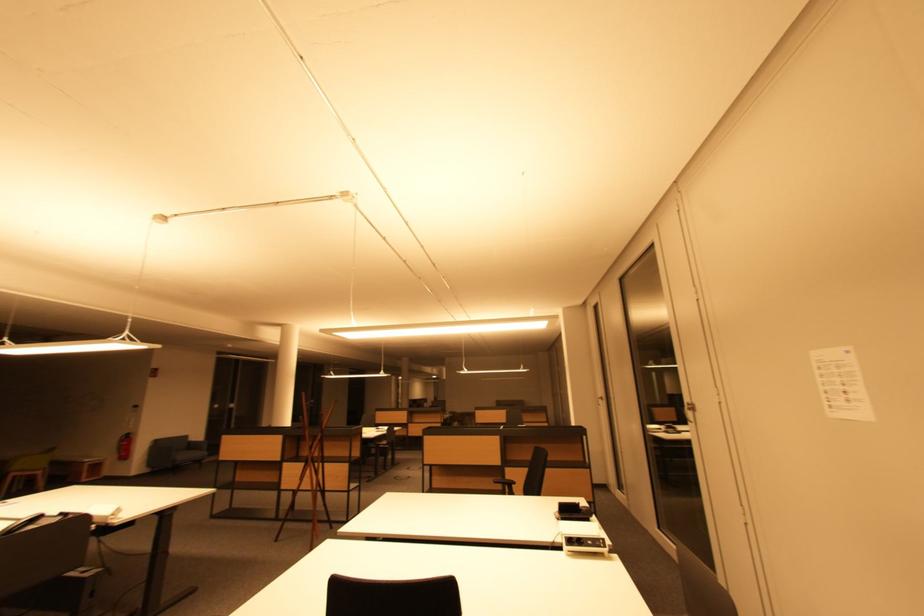
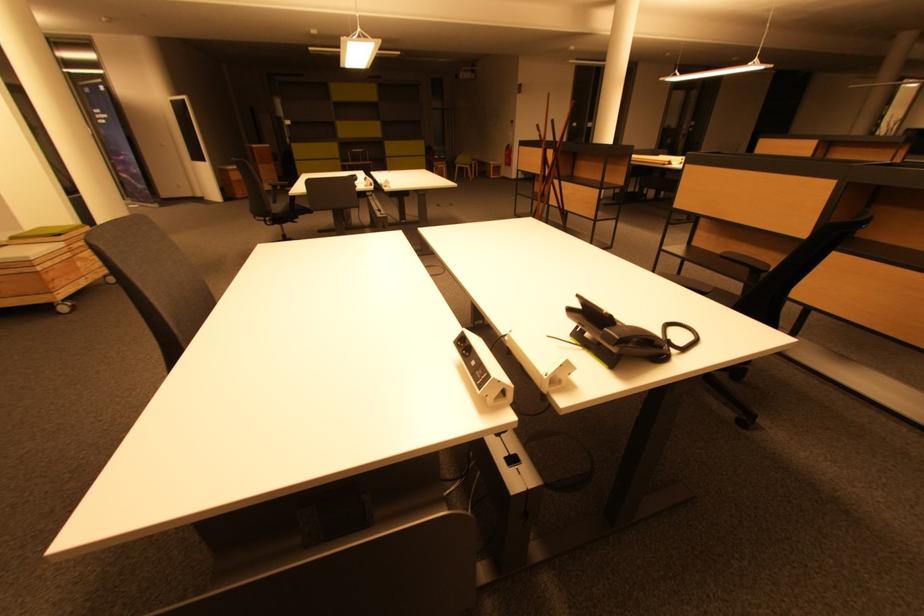
Find the pixel in the second image that matches (x=128, y=445) in the first image.

(512, 155)